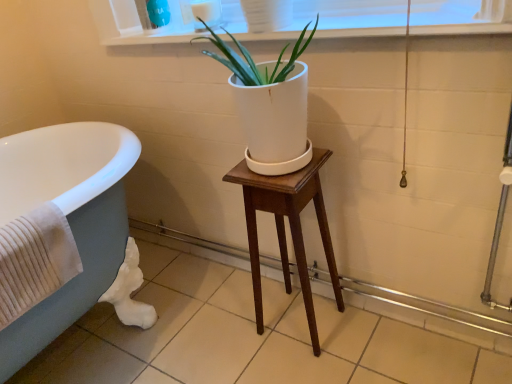
Identify the location of vacant space in matte gray tub at left (from a real-world perspective). (101, 340).